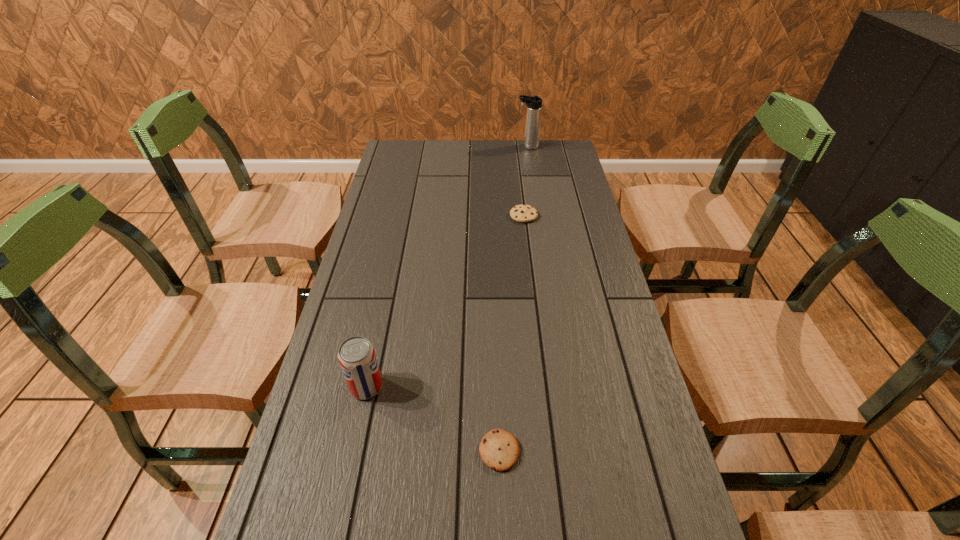
This screenshot has height=540, width=960. Find the location of `the tallest object`. the tallest object is located at coordinates (534, 104).

The height and width of the screenshot is (540, 960). Find the location of `thermos bottle`. thermos bottle is located at coordinates (534, 104).

This screenshot has width=960, height=540. What are the coordinates of `the leftmost object` in the screenshot? It's located at click(356, 355).

At what (x,y) coordinates should I click in order to perform the action: click on the second tallest object. Please return your answer as a coordinate pair (x, y). Looking at the image, I should click on (356, 355).

Find the location of `the second farthest object`. the second farthest object is located at coordinates (521, 213).

Where is `the taller cookie`? This screenshot has height=540, width=960. the taller cookie is located at coordinates (521, 213).

At what (x,y) coordinates should I click in order to perform the action: click on the third object from right to left. Please return your answer as a coordinate pair (x, y). Image resolution: width=960 pixels, height=540 pixels. Looking at the image, I should click on (499, 450).

You are a GUI agent. You are given a task and a screenshot of the screen. Output one action in this format:
    pyautogui.click(x=<x>, y=<y>)
    Task: Click on the shortest object
    The height and width of the screenshot is (540, 960).
    Given the screenshot: What is the action you would take?
    pyautogui.click(x=499, y=450)

I want to click on free space located on the handle side of the thermos bottle, so click(504, 147).

This screenshot has height=540, width=960. Find the location of `vacant space located 0.150m on the handle side of the thermos bottle`. vacant space located 0.150m on the handle side of the thermos bottle is located at coordinates (480, 147).